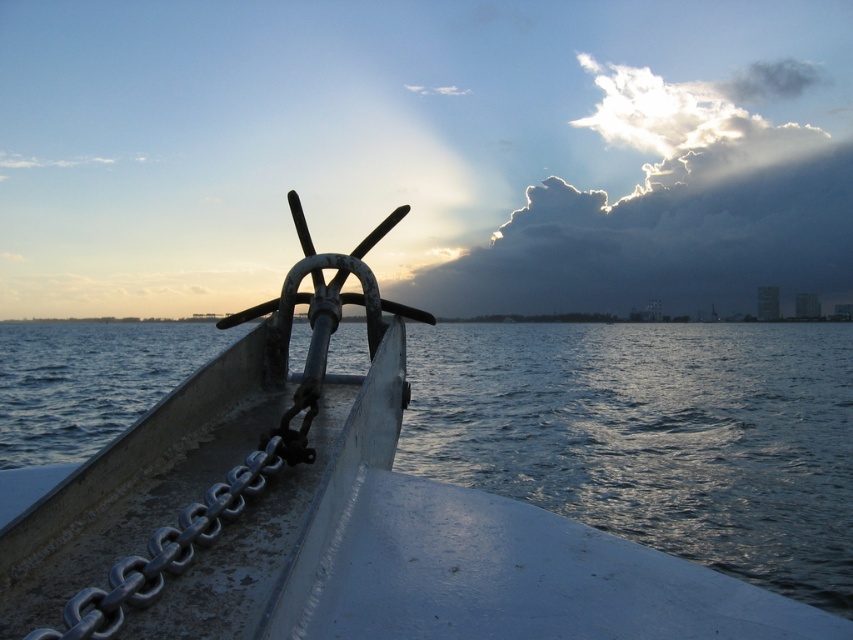
You are the captain of the ship and need to determine the position of the metallic chain anchor at center relative to the cloudy sky at upper center. From your vantage point on the bow, which object is higher in the image?

The cloudy sky at upper center is higher than the metallic chain anchor at center because the anchor is below the sky.

You are a sailor on the deck of the boat. You need to secure the metallic chain anchor at center before the storm hits. However, you notice the cloudy sky at upper center. Which object is positioned to the left of the other?

The metallic chain anchor at center is to the left of cloudy sky at upper center.